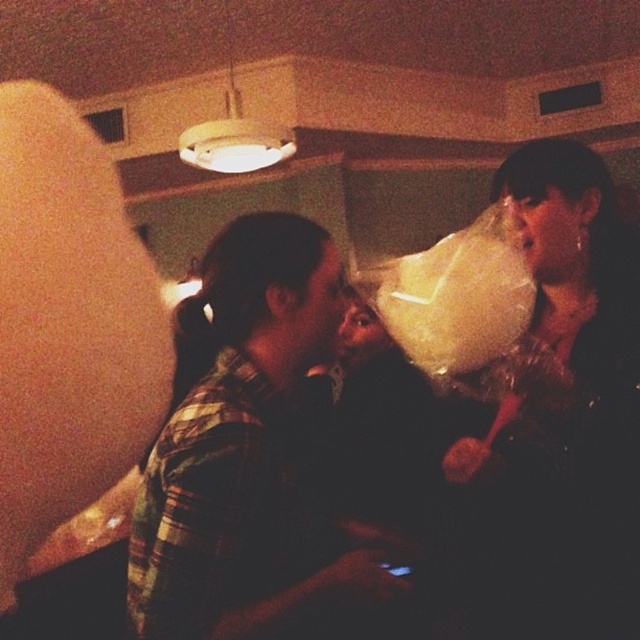
Question: Which of the following is the closest to the observer?

Choices:
 (A) (284, 493)
 (B) (307, 244)
 (C) (579, 339)

Answer: (A)

Question: Which object appears farthest from the camera in this image?

Choices:
 (A) white fluffy cotton candy at upper right
 (B) plaid shirt at center

Answer: (A)

Question: Can you confirm if plaid shirt at center is positioned to the left of green plaid shirt at center?

Choices:
 (A) no
 (B) yes

Answer: (A)

Question: Does plaid shirt at center have a lesser width compared to white fluffy cotton candy at upper right?

Choices:
 (A) yes
 (B) no

Answer: (B)

Question: Does plaid shirt at center have a larger size compared to white fluffy cotton candy at upper right?

Choices:
 (A) yes
 (B) no

Answer: (A)

Question: Based on their relative distances, which object is farther from the white fluffy cotton candy at upper right?

Choices:
 (A) green plaid shirt at center
 (B) plaid shirt at center

Answer: (A)